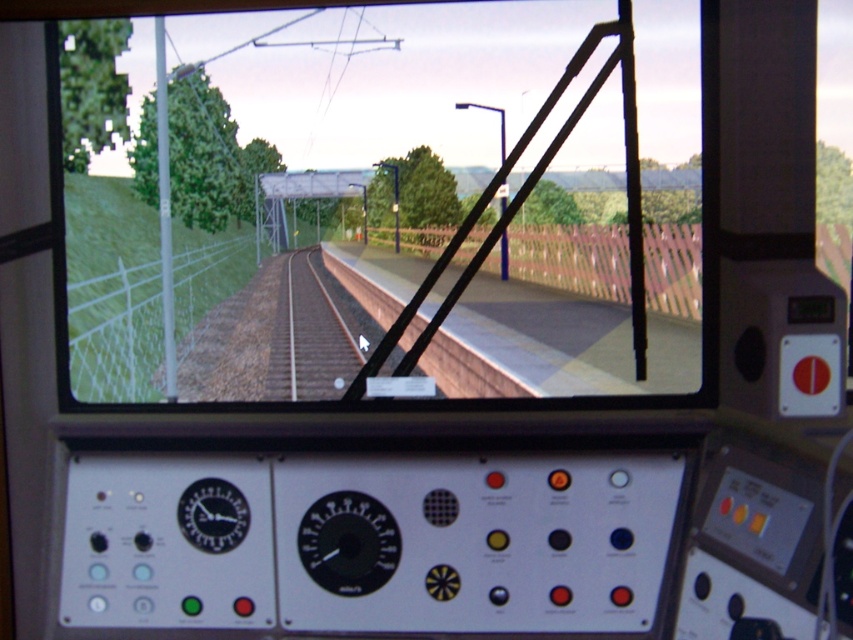
Does point (283, 376) come behind point (207, 497)?

That is True.

What do you see at coordinates (310, 337) in the screenshot? I see `brown gravel train track at center` at bounding box center [310, 337].

Locate an element on the screen. The width and height of the screenshot is (853, 640). brown gravel train track at center is located at coordinates (310, 337).

Can you confirm if black plastic gauge at center is positioned to the right of black plastic clock at center?

Correct, you'll find black plastic gauge at center to the right of black plastic clock at center.

Does black plastic gauge at center lie behind black plastic clock at center?

No, it is in front of black plastic clock at center.

Find the location of a particular element. The image size is (853, 640). black plastic gauge at center is located at coordinates (347, 541).

Can you confirm if brown gravel train track at center is bigger than black plastic gauge at center?

Correct, brown gravel train track at center is larger in size than black plastic gauge at center.

Between brown gravel train track at center and black plastic gauge at center, which one appears on the left side from the viewer's perspective?

brown gravel train track at center is more to the left.

Does point (279, 396) come behind point (387, 545)?

Yes, point (279, 396) is farther from viewer.

This screenshot has height=640, width=853. I want to click on brown gravel train track at center, so click(x=310, y=337).